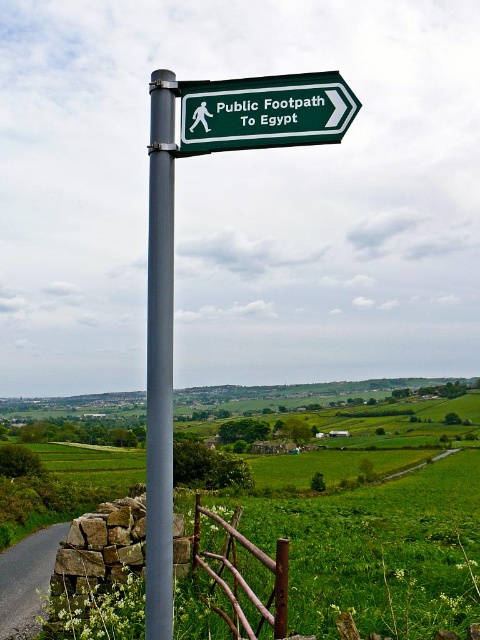
You are a hiker trying to take a photo of the gray metallic pole at center and the rustic wood fence at lower center. Which object should you focus on first to ensure both are in the frame without moving the camera?

You should focus on the gray metallic pole at center first because it is in front of the rustic wood fence at lower center, so keeping it centered will allow the fence to remain in the background of the frame.

You are a hiker trying to determine the best path to follow the gray metallic pole at center and the rustic wood fence at lower center. Which object is bigger and might be easier to spot from a distance?

The gray metallic pole at center is larger in size compared to the rustic wood fence at lower center, so it would be easier to spot from a distance.

Looking at this image, you are a surveyor measuring distances between landmarks. You need to determine if the distance between the gray metallic pole at center and the green matte signpost at upper center is sufficient to place a 30 inch wide equipment between them. Can you confirm if the space is enough?

The gray metallic pole at center and green matte signpost at upper center are 34.17 inches apart, which is wider than the 30 inch equipment. Therefore, the equipment can be placed between them.